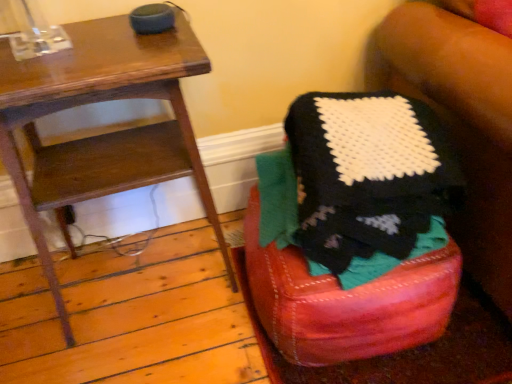
Question: Does knitted fabric stool at lower right contain wooden side table at left?

Choices:
 (A) no
 (B) yes

Answer: (A)

Question: Can you confirm if knitted fabric stool at lower right is taller than wooden side table at left?

Choices:
 (A) yes
 (B) no

Answer: (B)

Question: Does knitted fabric stool at lower right turn towards wooden side table at left?

Choices:
 (A) no
 (B) yes

Answer: (A)

Question: Can you confirm if knitted fabric stool at lower right is shorter than wooden side table at left?

Choices:
 (A) yes
 (B) no

Answer: (A)

Question: From the image's perspective, is knitted fabric stool at lower right on top of wooden side table at left?

Choices:
 (A) yes
 (B) no

Answer: (B)

Question: Are knitted fabric stool at lower right and wooden side table at left beside each other?

Choices:
 (A) no
 (B) yes

Answer: (A)

Question: Is wooden side table at left facing away from knitted fabric stool at lower right?

Choices:
 (A) no
 (B) yes

Answer: (A)

Question: From a real-world perspective, is wooden side table at left below knitted fabric stool at lower right?

Choices:
 (A) no
 (B) yes

Answer: (A)

Question: Does wooden side table at left have a larger size compared to knitted fabric stool at lower right?

Choices:
 (A) no
 (B) yes

Answer: (B)

Question: Could you tell me if wooden side table at left is turned towards knitted fabric stool at lower right?

Choices:
 (A) no
 (B) yes

Answer: (A)

Question: Are wooden side table at left and knitted fabric stool at lower right located far from each other?

Choices:
 (A) yes
 (B) no

Answer: (B)

Question: Does wooden side table at left come behind knitted fabric stool at lower right?

Choices:
 (A) no
 (B) yes

Answer: (A)

Question: Does point (120, 51) appear closer or farther from the camera than point (279, 314)?

Choices:
 (A) closer
 (B) farther

Answer: (A)